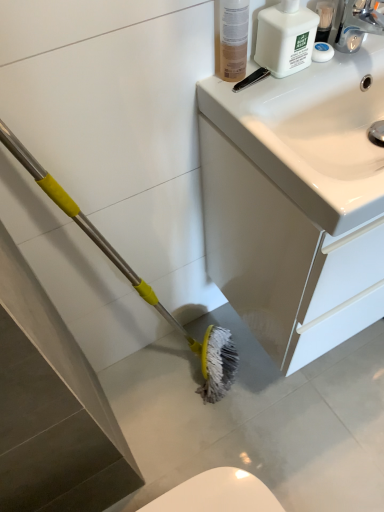
The height and width of the screenshot is (512, 384). What are the coordinates of `free space in front of white plastic bottle at upper right` in the screenshot? It's located at (281, 96).